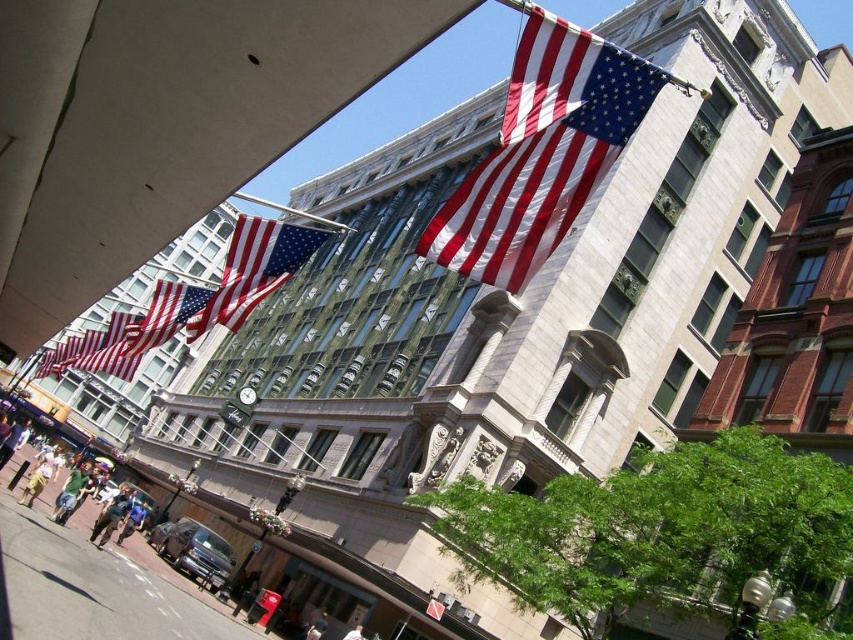
Question: Considering the real-world distances, which object is farthest from the red-white-striped fabric flag at upper center?

Choices:
 (A) red-white-striped fabric flag at center
 (B) red-white-blue fabric flag at center-left

Answer: (B)

Question: Which of the following is the farthest from the observer?

Choices:
 (A) red-white-striped fabric flag at upper center
 (B) red-white-blue fabric flag at center-left
 (C) red-white-striped fabric flag at center

Answer: (B)

Question: Considering the relative positions of red-white-striped fabric flag at upper center and red-white-blue fabric flag at center in the image provided, where is red-white-striped fabric flag at upper center located with respect to red-white-blue fabric flag at center?

Choices:
 (A) right
 (B) left

Answer: (A)

Question: Does red-white-striped fabric flag at upper center appear over red-white-blue fabric flag at center?

Choices:
 (A) no
 (B) yes

Answer: (B)

Question: Which point appears farthest from the camera in this image?

Choices:
 (A) (157, 337)
 (B) (248, 234)
 (C) (119, 365)
 (D) (442, 211)

Answer: (C)

Question: Considering the relative positions of red-white-blue fabric flag at center and red-white-striped fabric flag at center in the image provided, where is red-white-blue fabric flag at center located with respect to red-white-striped fabric flag at center?

Choices:
 (A) right
 (B) left

Answer: (A)